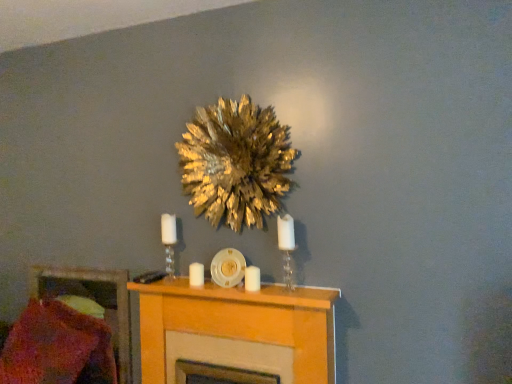
Question: From a real-world perspective, relative to knitted wool pillow at lower left, is white glass candle holder at center, the 2th candle holder viewed from the front, vertically above or below?

Choices:
 (A) below
 (B) above

Answer: (B)

Question: In terms of height, does white glass candle holder at center, positioned as the first candle holder in left-to-right order, look taller or shorter compared to knitted wool pillow at lower left?

Choices:
 (A) short
 (B) tall

Answer: (A)

Question: Estimate the real-world distances between objects in this image. Which object is closer to the gold leafy wreath at upper center?

Choices:
 (A) clear glass candle holder at center, the first candle holder positioned from the right
 (B) white glass candle holder at center, the 1th candle holder when ordered from back to front
 (C) knitted wool pillow at lower left
 (D) light wood fireplace at center
 (E) white matte candle at center, the first candle from the front

Answer: (A)

Question: Considering the real-world distances, which object is farthest from the clear glass candle holder at center, the second candle holder positioned from the left?

Choices:
 (A) knitted wool pillow at lower left
 (B) white matte candle at center, arranged as the first candle when viewed from the back
 (C) gold leafy wreath at upper center
 (D) light wood fireplace at center
 (E) white glass candle holder at center, positioned as the first candle holder in left-to-right order

Answer: (A)